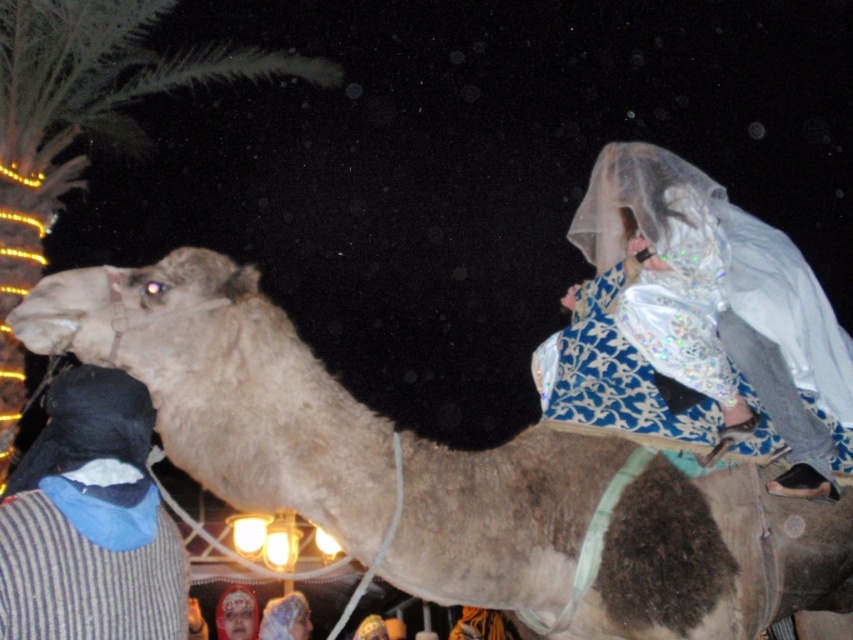
Question: Can you confirm if fuzzy beige camel at center is positioned to the left of black fabric at left?

Choices:
 (A) yes
 (B) no

Answer: (B)

Question: Among these points, which one is nearest to the camera?

Choices:
 (A) (39, 16)
 (B) (610, 205)

Answer: (B)

Question: Which point is closer to the camera taking this photo?

Choices:
 (A) (x=692, y=232)
 (B) (x=91, y=556)
 (C) (x=102, y=32)
 (D) (x=218, y=348)

Answer: (B)

Question: Which of the following is the closest to the observer?

Choices:
 (A) green leafy palm at upper left
 (B) shiny silver dress at upper right
 (C) black fabric at left
 (D) fuzzy beige camel at center

Answer: (C)

Question: Does black fabric at left appear over green leafy palm at upper left?

Choices:
 (A) no
 (B) yes

Answer: (A)

Question: Can you confirm if black fabric at left is positioned below green leafy palm at upper left?

Choices:
 (A) yes
 (B) no

Answer: (A)